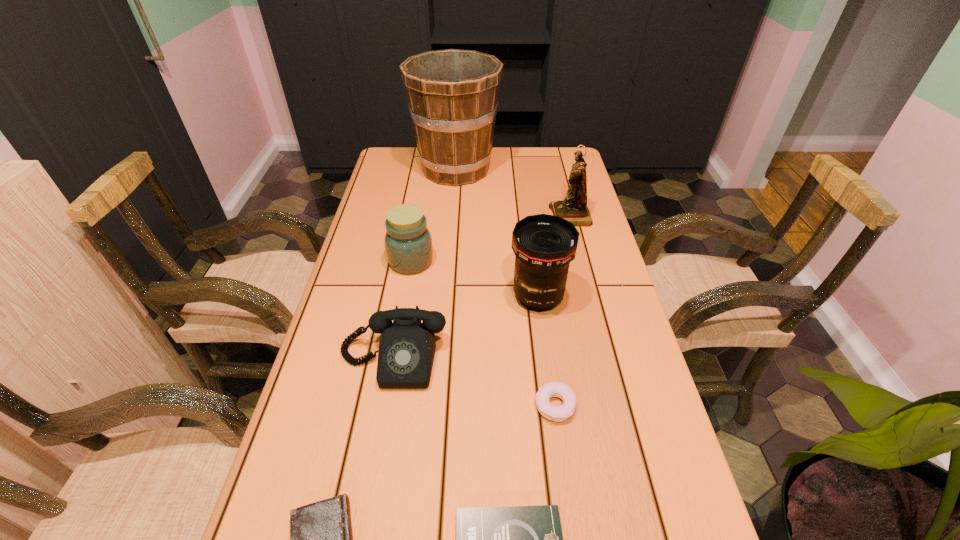
Where is `vacant space situated 0.220m on the front-facing side of the figurine`? This screenshot has height=540, width=960. vacant space situated 0.220m on the front-facing side of the figurine is located at coordinates (483, 216).

This screenshot has height=540, width=960. Find the location of `vacant space situated on the front-facing side of the figurine`. vacant space situated on the front-facing side of the figurine is located at coordinates (492, 216).

Find the location of `free spot located on the right of the telephoto lens`. free spot located on the right of the telephoto lens is located at coordinates (624, 297).

Where is `blank space located 0.200m on the right of the fifth shortest object`? The height and width of the screenshot is (540, 960). blank space located 0.200m on the right of the fifth shortest object is located at coordinates (503, 261).

The image size is (960, 540). Identify the location of free space located on the dial of the telephone. (370, 490).

This screenshot has width=960, height=540. I want to click on blank space located 0.080m on the front of the doughnut, so click(x=564, y=463).

Where is `object present at the far edge`? This screenshot has width=960, height=540. object present at the far edge is located at coordinates (452, 94).

The height and width of the screenshot is (540, 960). In order to click on bucket present at the left edge in this screenshot , I will do `click(452, 94)`.

The width and height of the screenshot is (960, 540). Find the location of `jar present at the left edge`. jar present at the left edge is located at coordinates click(x=408, y=243).

This screenshot has height=540, width=960. What are the coordinates of `telephone that is at the left edge` in the screenshot? It's located at (407, 347).